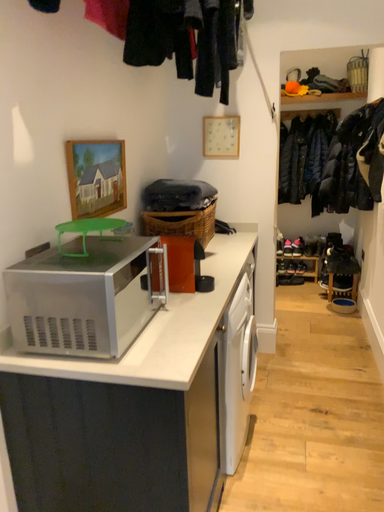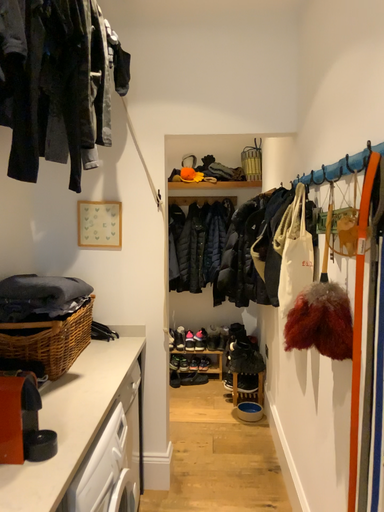
Question: Which way did the camera rotate in the video?

Choices:
 (A) rotated right
 (B) rotated left

Answer: (A)